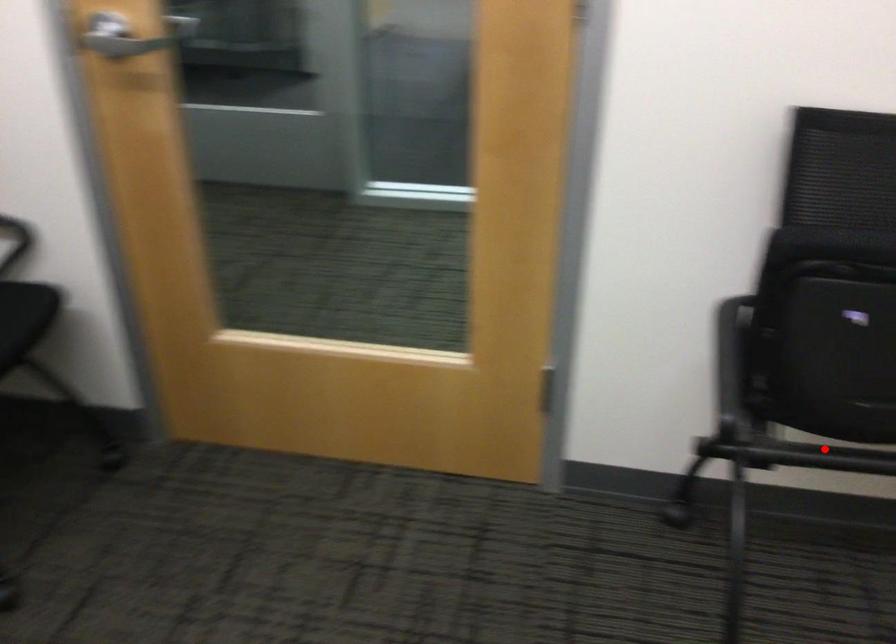
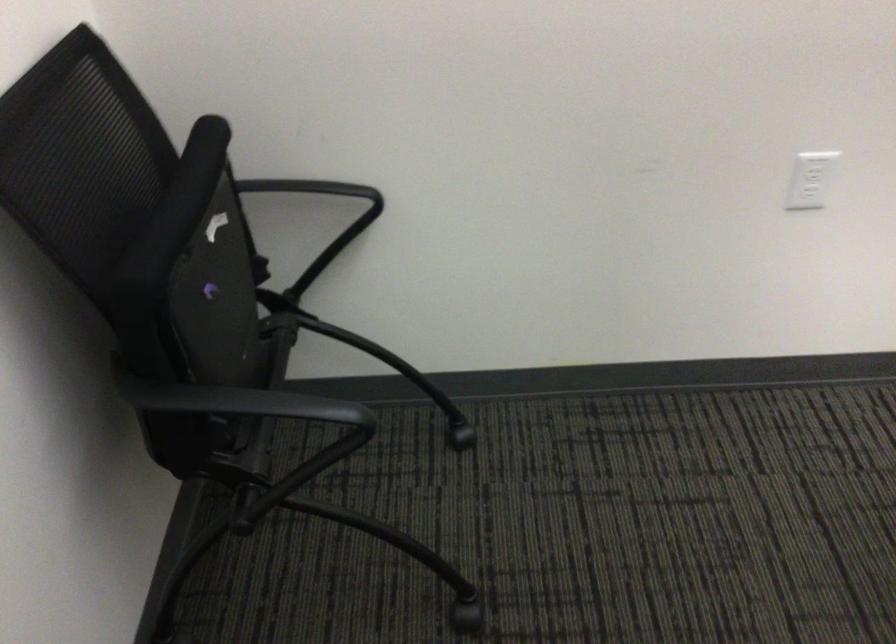
Where in the second image is the point corresponding to the highlighted location from the first image?

(254, 420)